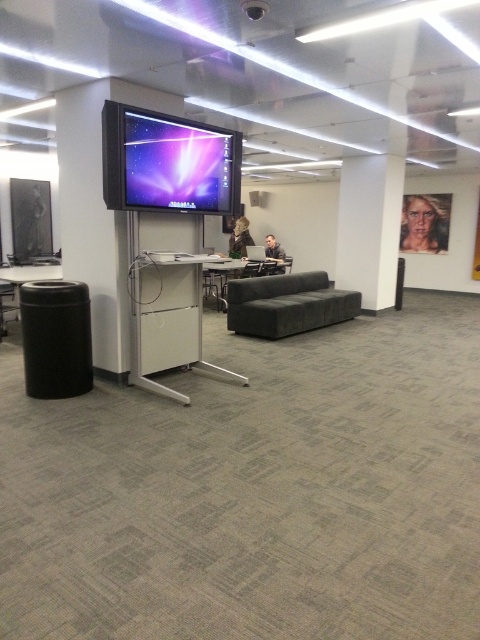
You are organizing a small meeting in the office and need to seat 5 people. The dark gray fabric couch at center and the matte gray couch at center are available. Which couch can accommodate more people?

The dark gray fabric couch at center has a larger width than the matte gray couch at center, so it can accommodate more people.

You are standing in the center of the room and want to move to the dark gray fabric couch at center. According to the coordinates provided, is the couch directly in front of you or to one side?

The dark gray fabric couch at center is located at point coordinates, so it is directly in front of you.

You are organizing a meeting in the office and need to seat two people on the couches. Which couch would allow for more legroom? Please choose between the dark gray fabric couch at center and the matte gray couch at center.

The matte gray couch at center is taller, so it likely has more legroom compared to the dark gray fabric couch at center.